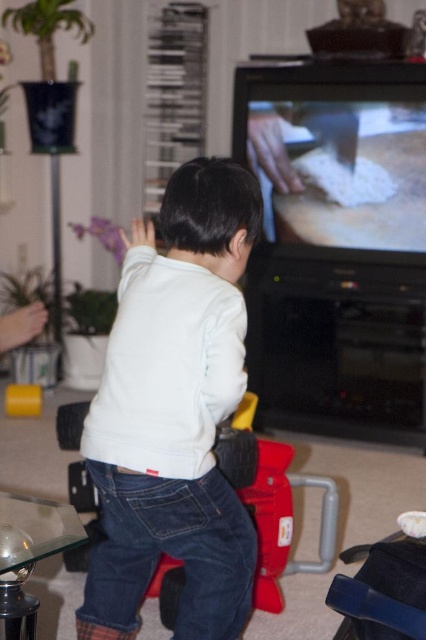
Question: Considering the relative positions of white matte shirt at center and red plastic toy car at center in the image provided, where is white matte shirt at center located with respect to red plastic toy car at center?

Choices:
 (A) above
 (B) below

Answer: (A)

Question: Is white matte shirt at center above red plastic toy car at center?

Choices:
 (A) no
 (B) yes

Answer: (B)

Question: In this image, where is white matte shirt at center located relative to red plastic toy car at center?

Choices:
 (A) right
 (B) left

Answer: (B)